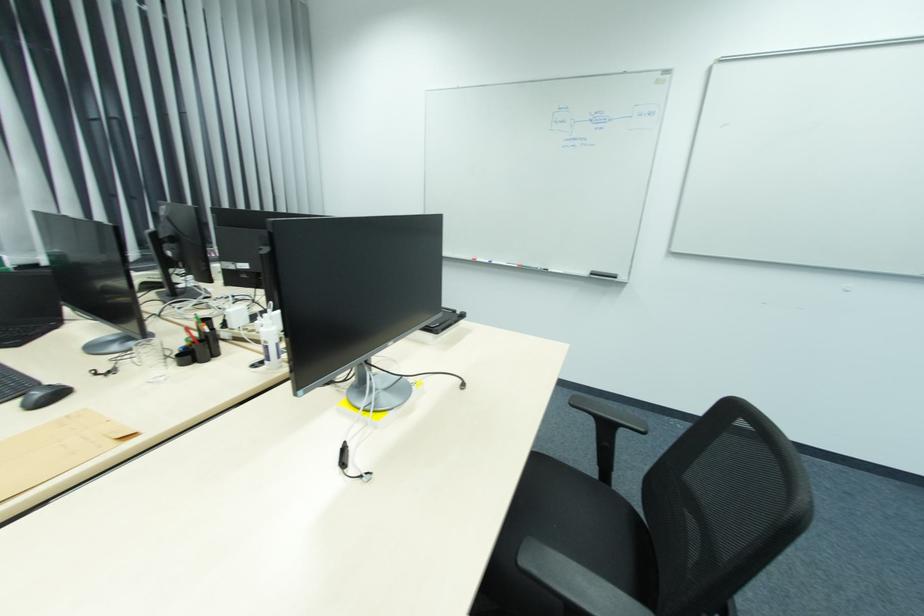
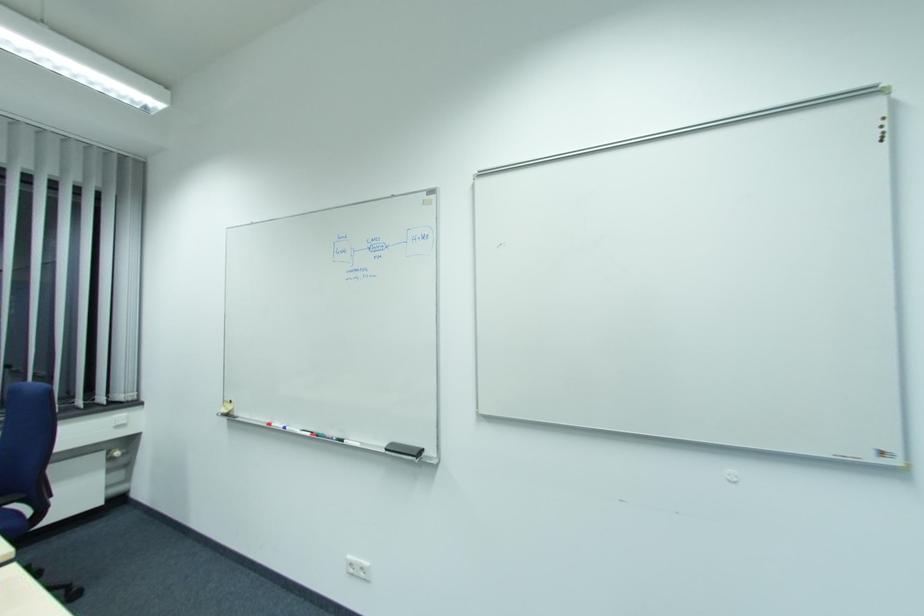
Where in the second image is the point corresponding to pixel 549 270 from the first image?

(344, 440)